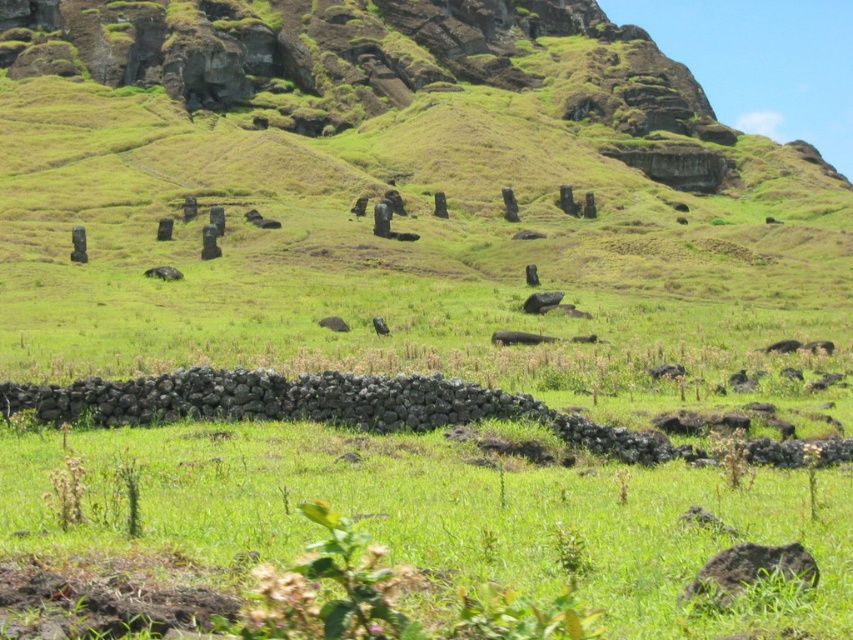
Can you confirm if brown stone moai at center is smaller than black matte animal at center?

Correct, brown stone moai at center occupies less space than black matte animal at center.

Between brown stone moai at center and black matte animal at center, which one appears on the right side from the viewer's perspective?

Positioned to the right is black matte animal at center.

Which is behind, point (151, 269) or point (370, 321)?

The point (151, 269) is behind.

The image size is (853, 640). What are the coordinates of `brown stone moai at center` in the screenshot? It's located at [x=163, y=273].

Can you confirm if black fur animal at center is positioned to the left of black matte animal at center?

In fact, black fur animal at center is to the right of black matte animal at center.

Who is positioned more to the left, black fur animal at center or black matte animal at center?

black matte animal at center

The height and width of the screenshot is (640, 853). What do you see at coordinates (519, 337) in the screenshot?
I see `black fur animal at center` at bounding box center [519, 337].

Identify the location of black fur animal at center. (519, 337).

Is point (500, 340) positioned before point (183, 275)?

Yes, it is in front of point (183, 275).

Which is behind, point (517, 332) or point (167, 278)?

Positioned behind is point (167, 278).

This screenshot has width=853, height=640. Describe the element at coordinates (519, 337) in the screenshot. I see `black fur animal at center` at that location.

Where is `black fur animal at center`? The image size is (853, 640). black fur animal at center is located at coordinates (519, 337).